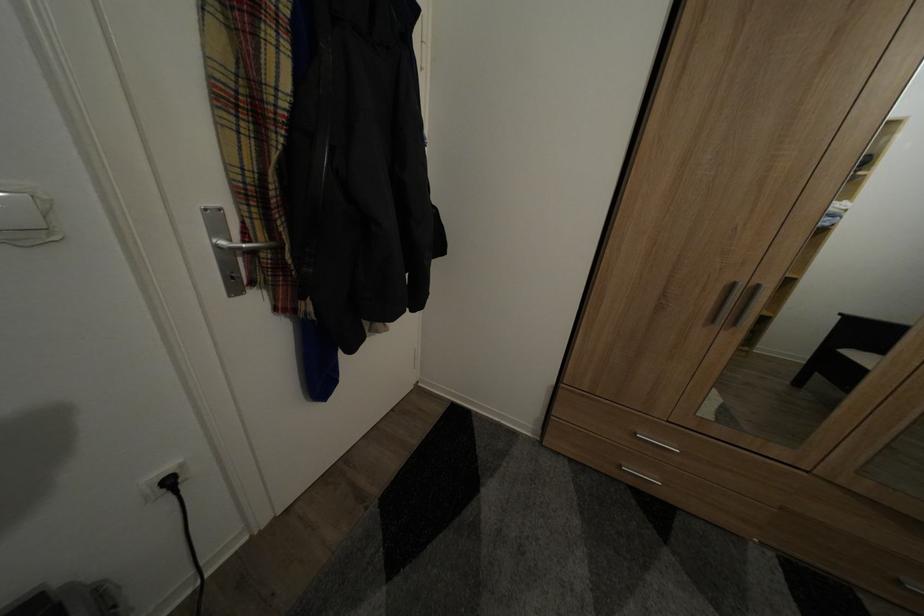
In order to click on silver door handle in this screenshot , I will do `click(245, 246)`.